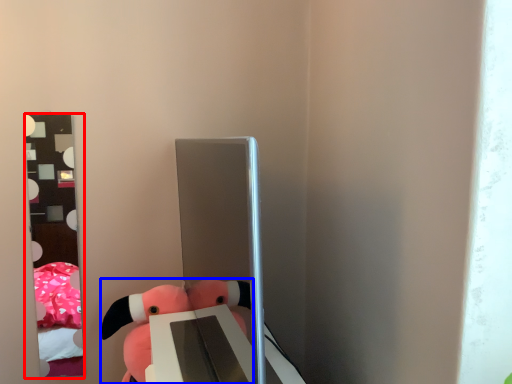
Question: Which object is further to the camera taking this photo, mirror (highlighted by a red box) or toy (highlighted by a blue box)?

Choices:
 (A) mirror
 (B) toy

Answer: (A)